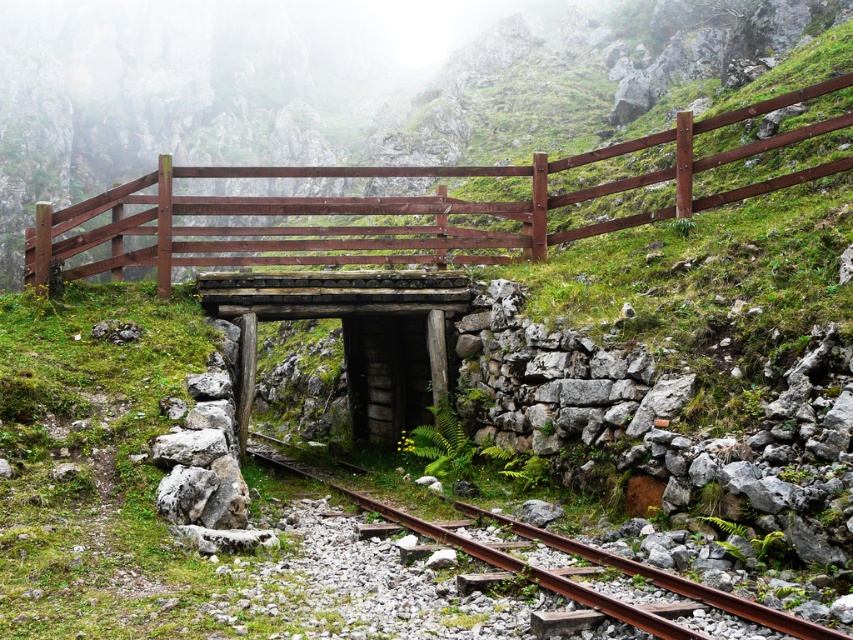
Is brown wooden fence at center further to the viewer compared to rusty metal train track at center?

Yes, it is behind rusty metal train track at center.

Is brown wooden fence at center thinner than rusty metal train track at center?

No.

Is point (247, 202) closer to camera compared to point (610, 611)?

No, (247, 202) is behind (610, 611).

This screenshot has height=640, width=853. I want to click on brown wooden fence at center, so click(x=387, y=209).